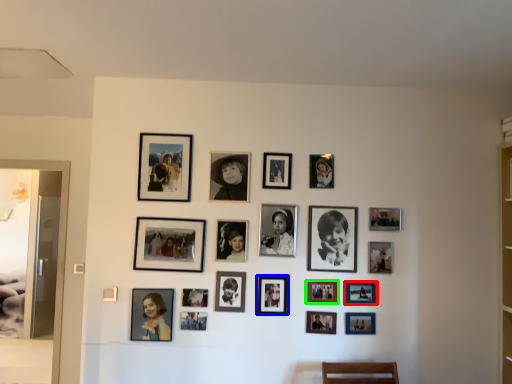
Question: Which is nearer to the picture frame (highlighted by a red box)? picture frame (highlighted by a blue box) or picture frame (highlighted by a green box).

Choices:
 (A) picture frame
 (B) picture frame

Answer: (B)